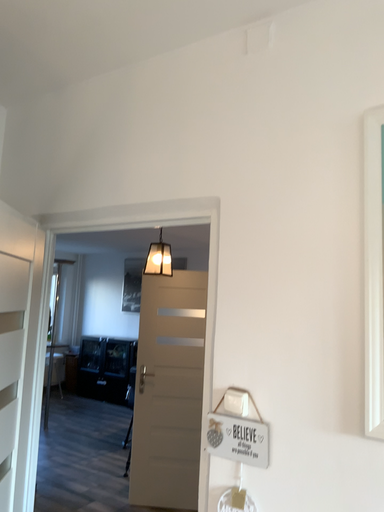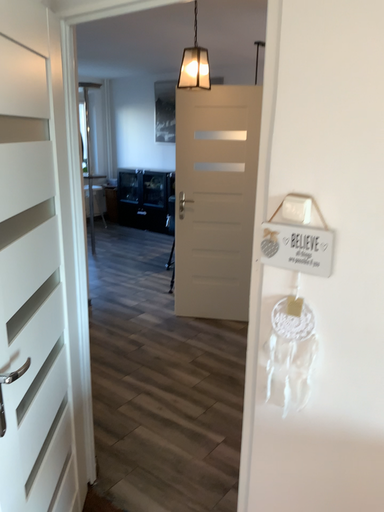
Question: Which way did the camera rotate in the video?

Choices:
 (A) rotated upward
 (B) rotated downward

Answer: (B)